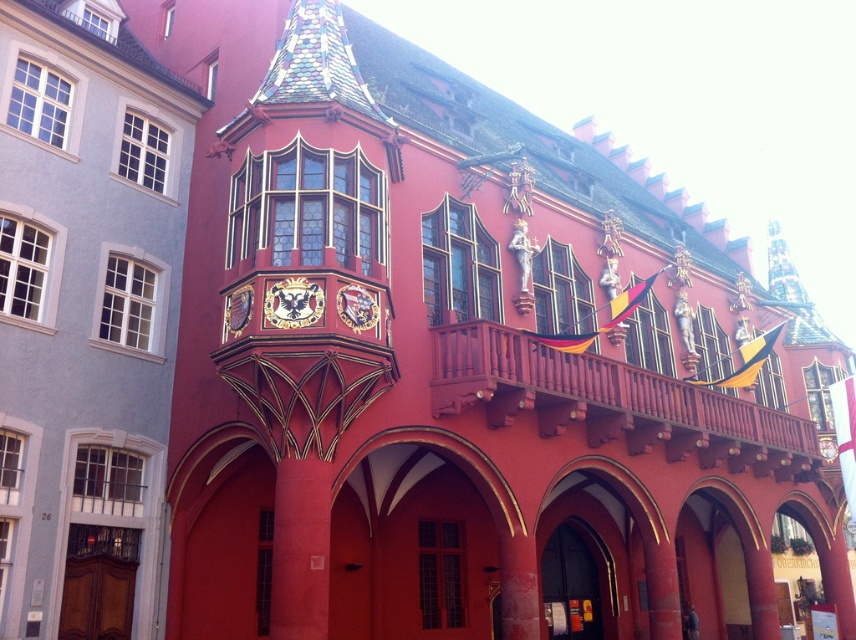
Question: Does wooden at center have a lesser width compared to matte gold clock at center?

Choices:
 (A) yes
 (B) no

Answer: (B)

Question: Which point is closer to the camera?

Choices:
 (A) (849, 378)
 (B) (611, 316)
 (C) (789, 433)

Answer: (B)

Question: Considering the real-world distances, which object is farthest from the matte gold clock at center?

Choices:
 (A) wooden at center
 (B) yellowmaterial/textureflag at upper right
 (C) yellow-black-red fabric flag at center

Answer: (B)

Question: Where is wooden at center located in relation to yellow and black fabric flag at upper right in the image?

Choices:
 (A) above
 (B) below

Answer: (B)

Question: Which object is farther from the camera taking this photo?

Choices:
 (A) yellowmaterial/textureflag at upper right
 (B) matte gold clock at center

Answer: (A)

Question: Can you confirm if matte gold clock at center is wider than yellow and black fabric flag at upper right?

Choices:
 (A) no
 (B) yes

Answer: (A)